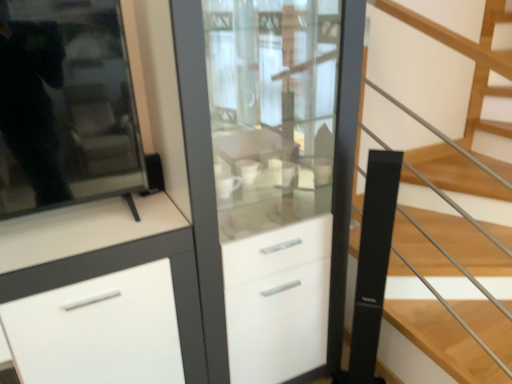
This screenshot has width=512, height=384. What do you see at coordinates (102, 294) in the screenshot?
I see `white matte cabinet at center` at bounding box center [102, 294].

The image size is (512, 384). I want to click on white matte cabinet at center, so click(102, 294).

Is white matte cabinet at center in front of or behind white glossy cabinet at center in the image?

Visually, white matte cabinet at center is located in front of white glossy cabinet at center.

How different are the orientations of white matte cabinet at center and white glossy cabinet at center in degrees?

white matte cabinet at center and white glossy cabinet at center are facing 0.00188 degrees away from each other.

Which of these two, white matte cabinet at center or white glossy cabinet at center, stands taller?

With more height is white glossy cabinet at center.

From the image's perspective, would you say white matte cabinet at center is shown under white glossy cabinet at center?

Yes, from the image's perspective, white matte cabinet at center is beneath white glossy cabinet at center.

Find the location of a particular element. cabinetry on the left of black matte stair at center is located at coordinates (102, 294).

From a real-world perspective, which object rests below the other?

In real-world perspective, white matte cabinet at center is lower.

Is white matte cabinet at center facing away from black matte stair at center?

No, black matte stair at center is not at the back of white matte cabinet at center.

How different are the orientations of white matte cabinet at center and black matte stair at center in degrees?

There is a 0.753-degree angle between the facing directions of white matte cabinet at center and black matte stair at center.

Which is behind, point (480, 144) or point (270, 207)?

Positioned behind is point (480, 144).

Based on the photo, which is more to the right, black matte stair at center or white glossy cabinet at center?

black matte stair at center.

Looking at this image, would you say black matte stair at center is outside white glossy cabinet at center?

That's correct, black matte stair at center is outside of white glossy cabinet at center.

Is black matte stair at center closer to the viewer compared to white glossy cabinet at center?

Yes, black matte stair at center is closer to the camera.

Can you confirm if white glossy cabinet at center is wider than black matte stair at center?

Incorrect, the width of white glossy cabinet at center does not surpass that of black matte stair at center.

Which point is more distant from viewer, [286,315] or [487,161]?

The point [487,161] is farther.

Is white glossy cabinet at center aimed at black matte stair at center?

No, white glossy cabinet at center is not turned towards black matte stair at center.

Where is `cabinetry below the black matte stair at center (from a real-world perspective)`? The height and width of the screenshot is (384, 512). cabinetry below the black matte stair at center (from a real-world perspective) is located at coordinates (102, 294).

How far apart are black matte stair at center and white matte cabinet at center?

The distance of black matte stair at center from white matte cabinet at center is 1.09 meters.

In the scene shown: Considering the relative positions of black matte stair at center and white matte cabinet at center in the image provided, is black matte stair at center behind white matte cabinet at center?

No, the depth of black matte stair at center is less than that of white matte cabinet at center.

Looking at this image, can you confirm if black matte stair at center is positioned to the left of white matte cabinet at center?

No.

Is white glossy cabinet at center facing away from white matte cabinet at center?

No, white glossy cabinet at center is not facing away from white matte cabinet at center.

Does white glossy cabinet at center lie behind white matte cabinet at center?

Yes, white glossy cabinet at center is behind white matte cabinet at center.

From the image's perspective, which is above, white glossy cabinet at center or white matte cabinet at center?

white glossy cabinet at center.

Locate an element on the screen. The height and width of the screenshot is (384, 512). dresser located on the right of white matte cabinet at center is located at coordinates (270, 177).

You are a GUI agent. You are given a task and a screenshot of the screen. Output one action in this format:
    pyautogui.click(x=<x>, y=<y>)
    Task: Click on the stairs in front of the white matte cabinet at center
    
    Given the screenshot: What is the action you would take?
    click(x=434, y=72)

From the image, which object appears to be nearer to black matte stair at center, white glossy cabinet at center or white matte cabinet at center?

Based on the image, white glossy cabinet at center appears to be nearer to black matte stair at center.

Looking at the image, which one is located further to white glossy cabinet at center, white matte cabinet at center or black matte stair at center?

The object further to white glossy cabinet at center is black matte stair at center.

Which object lies further to the anchor point white glossy cabinet at center, black matte stair at center or white matte cabinet at center?

Among the two, black matte stair at center is located further to white glossy cabinet at center.

Considering their positions, is white matte cabinet at center positioned closer to black matte stair at center than white glossy cabinet at center?

Based on the image, white glossy cabinet at center appears to be nearer to black matte stair at center.

Looking at the image, which one is located further to white matte cabinet at center, black matte stair at center or white glossy cabinet at center?

black matte stair at center.

Looking at the image, which one is located closer to white matte cabinet at center, white glossy cabinet at center or black matte stair at center?

The object closer to white matte cabinet at center is white glossy cabinet at center.

Where is `dresser between white matte cabinet at center and black matte stair at center`? The image size is (512, 384). dresser between white matte cabinet at center and black matte stair at center is located at coordinates (270, 177).